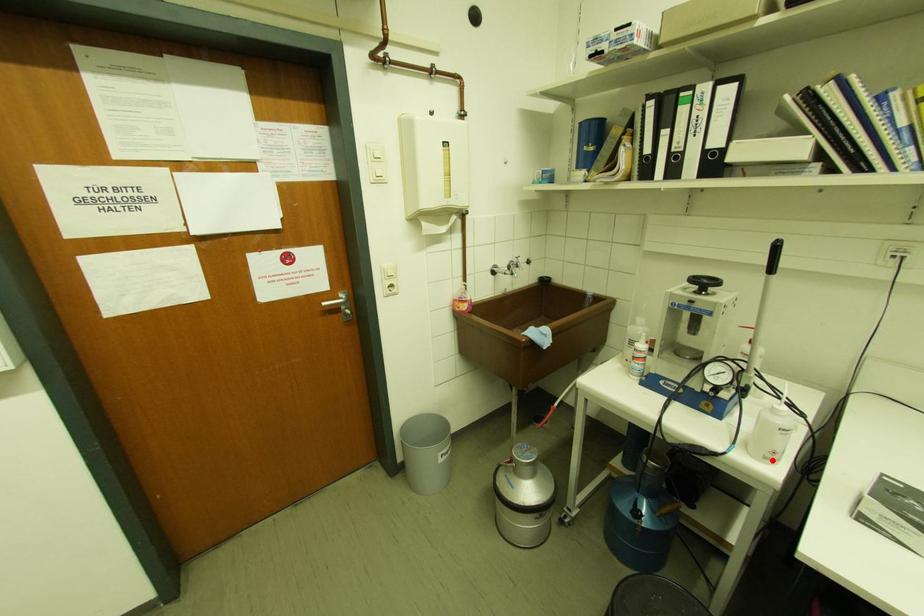
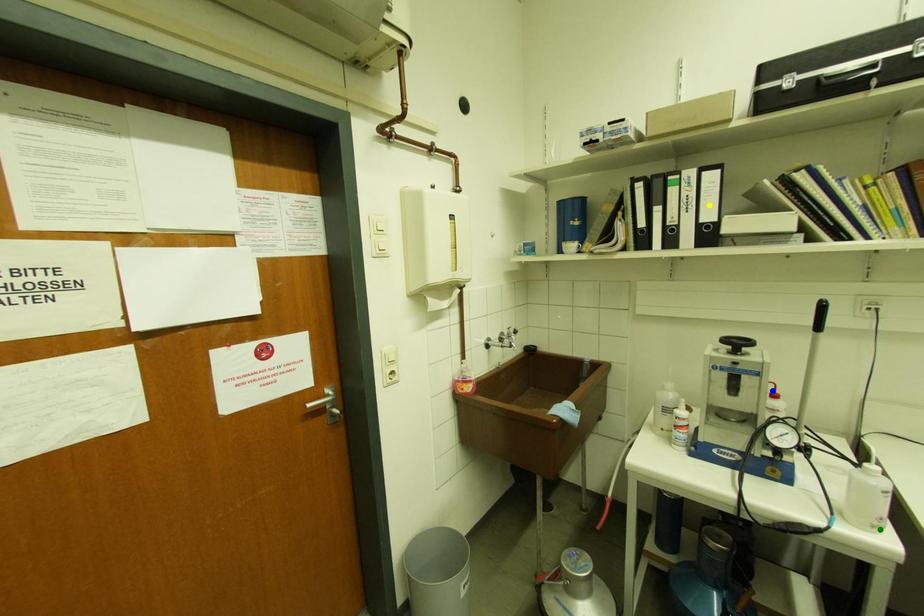
Question: I am providing you with two images of the same scene from different viewpoints. A red point is marked on the first image. You are given multiple points on the second image. Can you choose the point in image 2 that corresponds to the point in image 1?

Choices:
 (A) green point
 (B) blue point
 (C) yellow point

Answer: (A)